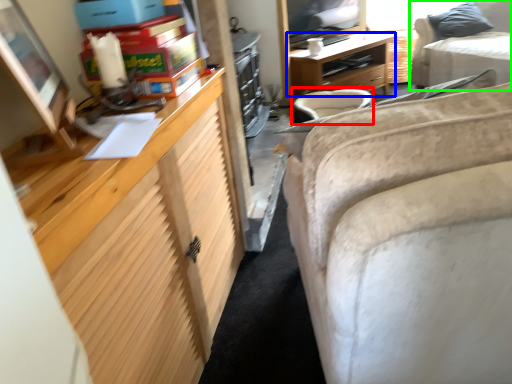
Question: Which object is the farthest from swivel chair (highlighted by a red box)? Choose among these: desk (highlighted by a blue box) or studio couch (highlighted by a green box).

Choices:
 (A) desk
 (B) studio couch

Answer: (B)